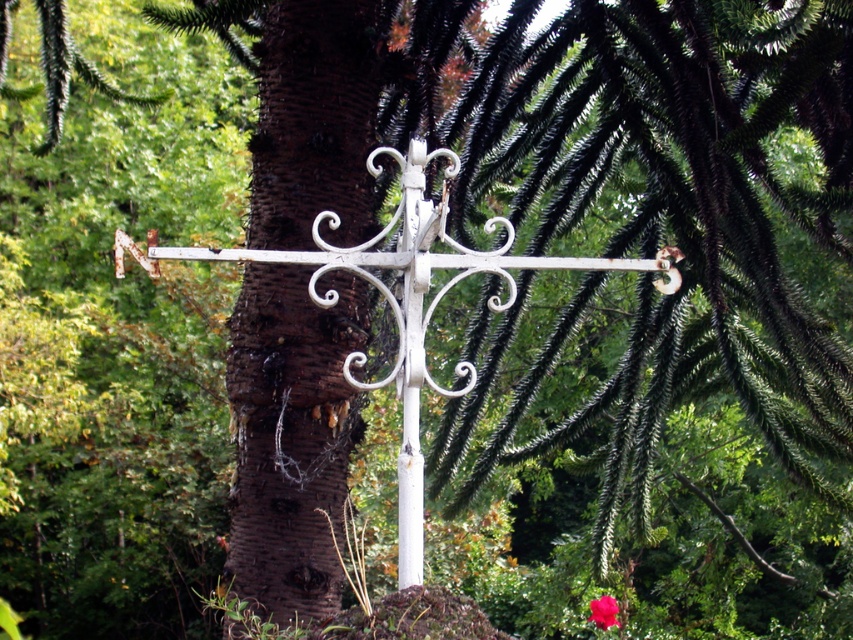
Question: Based on their relative distances, which object is nearer to the brown rough bark at center?

Choices:
 (A) white wrought iron cross at center
 (B) smooth pink rose at center

Answer: (A)

Question: Which of the following is the farthest from the observer?

Choices:
 (A) white wrought iron cross at center
 (B) brown rough bark at center
 (C) smooth pink rose at center

Answer: (C)

Question: Does brown rough bark at center appear on the right side of smooth pink rose at center?

Choices:
 (A) no
 (B) yes

Answer: (A)

Question: Which object is positioned closest to the white wrought iron cross at center?

Choices:
 (A) smooth pink rose at center
 (B) brown rough bark at center

Answer: (B)

Question: Is white wrought iron cross at center behind smooth pink rose at center?

Choices:
 (A) no
 (B) yes

Answer: (A)

Question: From the image, what is the correct spatial relationship of brown rough bark at center in relation to smooth pink rose at center?

Choices:
 (A) left
 (B) right

Answer: (A)